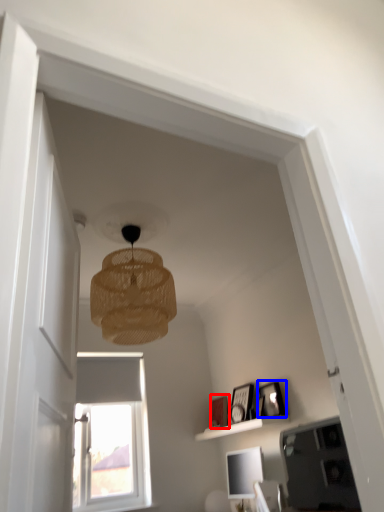
Question: Which object appears closest to the camera in this image, picture frame (highlighted by a red box) or picture frame (highlighted by a blue box)?

Choices:
 (A) picture frame
 (B) picture frame

Answer: (B)